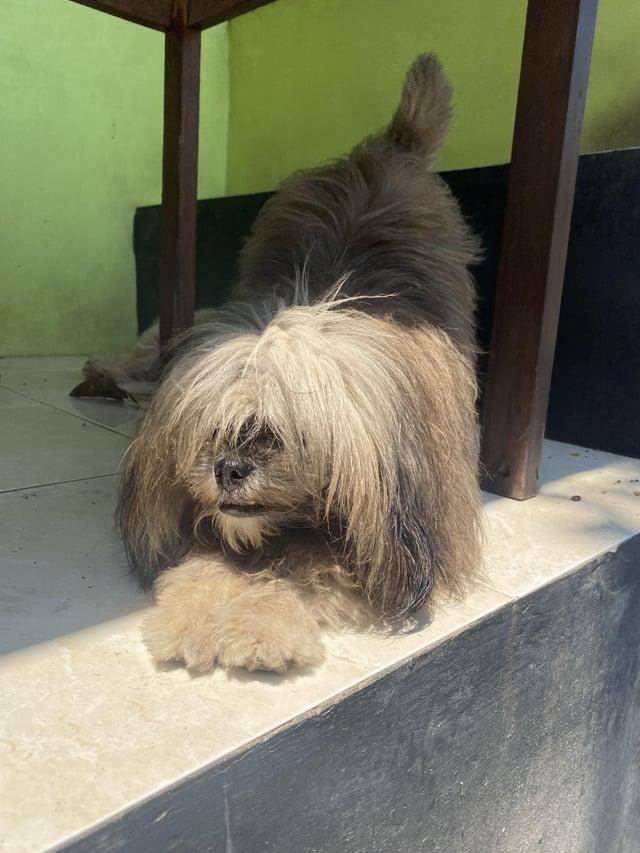
At what (x,y) coordinates should I click in order to perform the action: click on desk leg. Please return your answer as a coordinate pair (x, y). The width and height of the screenshot is (640, 853). Looking at the image, I should click on (506, 247).